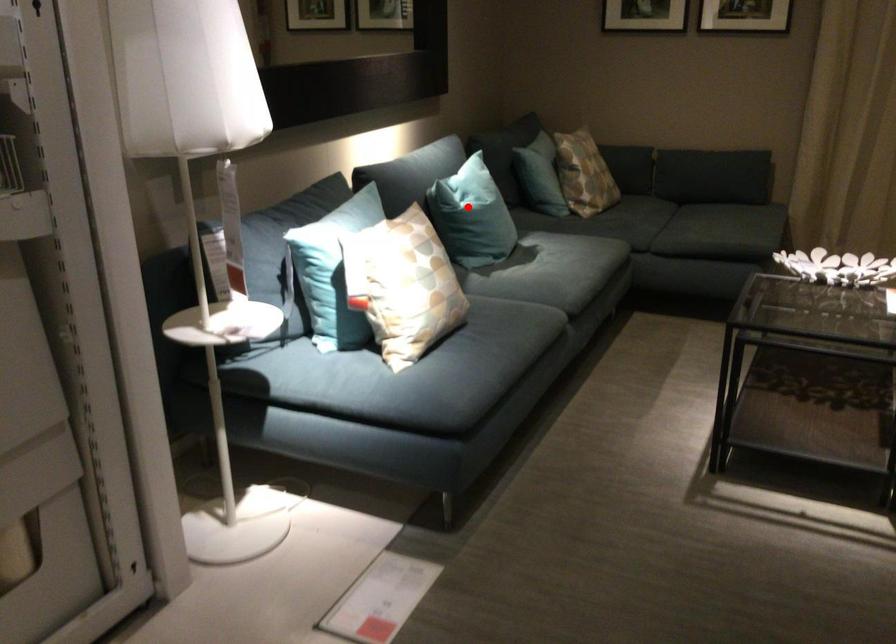
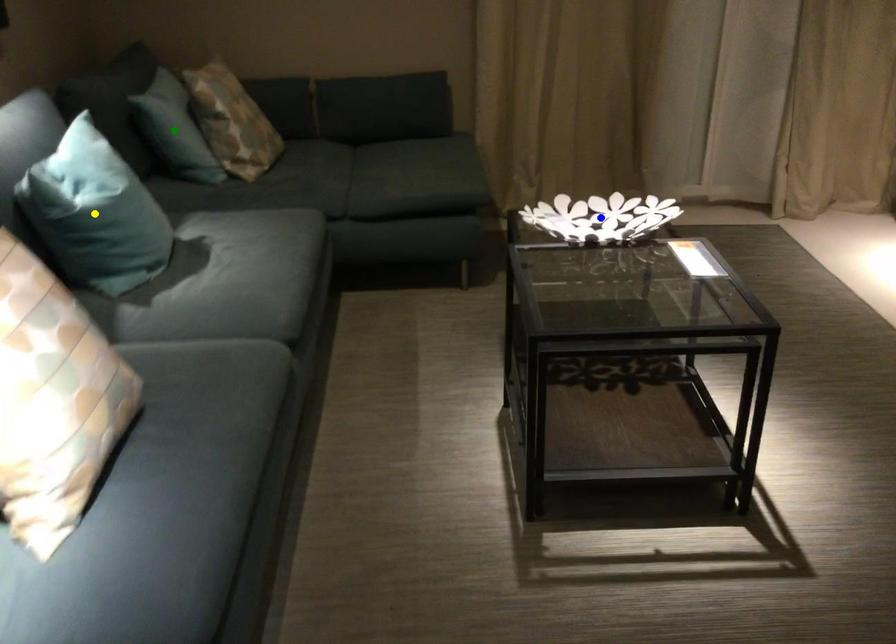
Question: I am providing you with two images of the same scene from different viewpoints. A red point is marked on the first image. You are given multiple points on the second image. Which spot in image 2 lines up with the point in image 1?

Choices:
 (A) green point
 (B) yellow point
 (C) blue point

Answer: (B)